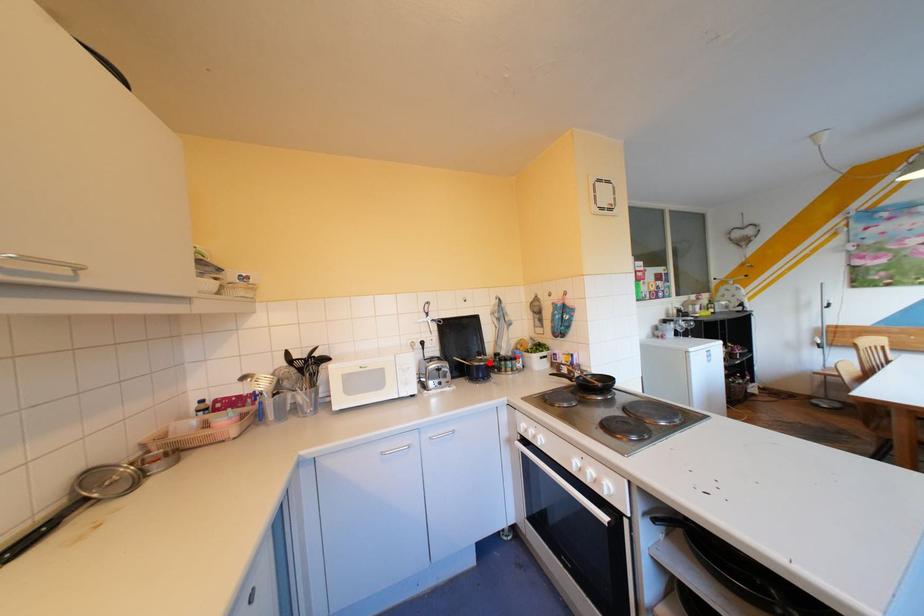
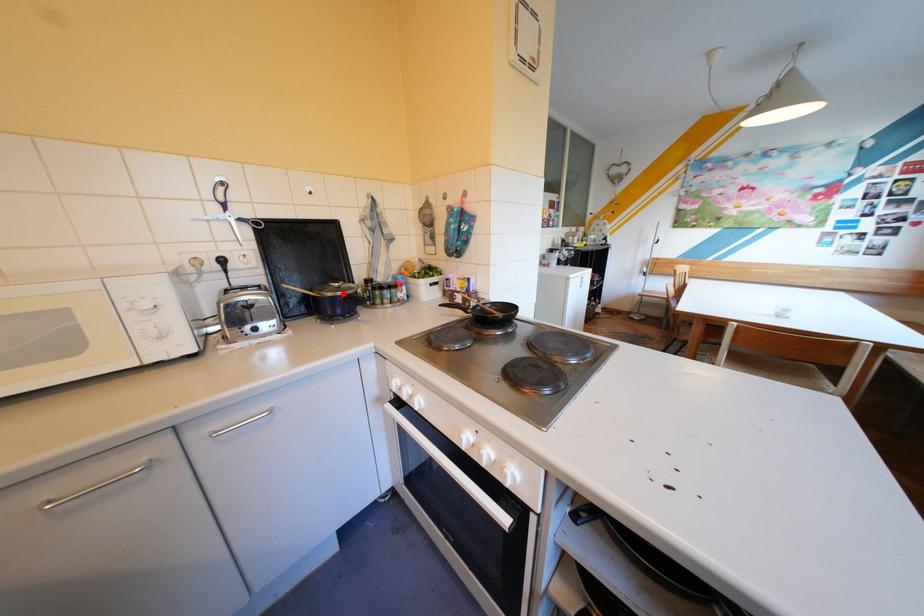
I am providing you with two images of the same scene from different viewpoints. A red point is marked on the first image and another point is marked on the second image. Is the red point in image1 aligned with the point shown in image2?

Yes